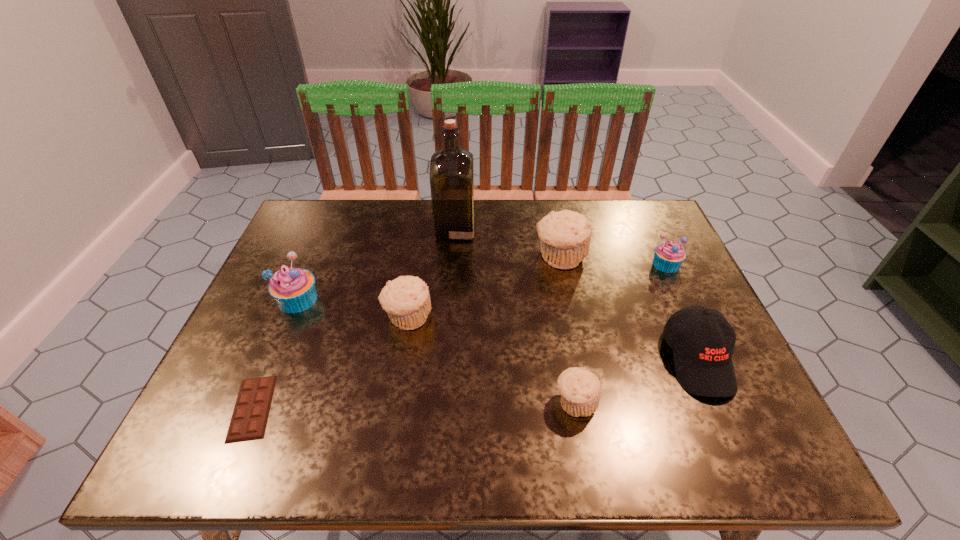
Identify the location of unoccupied position between the left blue muffin and the nearest muffin. The height and width of the screenshot is (540, 960). (437, 350).

Image resolution: width=960 pixels, height=540 pixels. I want to click on vacant space that is in between the leftmost beige muffin and the chocolate bar, so click(x=330, y=363).

Identify the location of unoccupied position between the second farthest beige muffin and the shortest object. The width and height of the screenshot is (960, 540). (330, 363).

At what (x,y) coordinates should I click in order to perform the action: click on vacant point located between the shortest object and the smallest beige muffin. Please return your answer as a coordinate pair (x, y). Looking at the image, I should click on (414, 405).

Image resolution: width=960 pixels, height=540 pixels. What are the coordinates of `vacant space in between the smaller blue muffin and the nearest beige muffin` in the screenshot? It's located at (621, 333).

Identify the location of vacant space that is in between the chocolate bar and the second nearest beige muffin. (330, 363).

Find the location of a particular element. The image size is (960, 540). object that is the fourth closest to the second muffin from left to right is located at coordinates (565, 236).

I want to click on object that can be found as the second closest to the nearest muffin, so click(406, 299).

Locate which muffin is the fourth closest to the biggest beige muffin. Please provide its 2D coordinates. Your answer should be formatted as a tuple, i.e. [(x, y)], where the tuple contains the x and y coordinates of a point satisfying the conditions above.

[(293, 288)]

Where is `the fourth closest muffin to the farther blue muffin`? The height and width of the screenshot is (540, 960). the fourth closest muffin to the farther blue muffin is located at coordinates (293, 288).